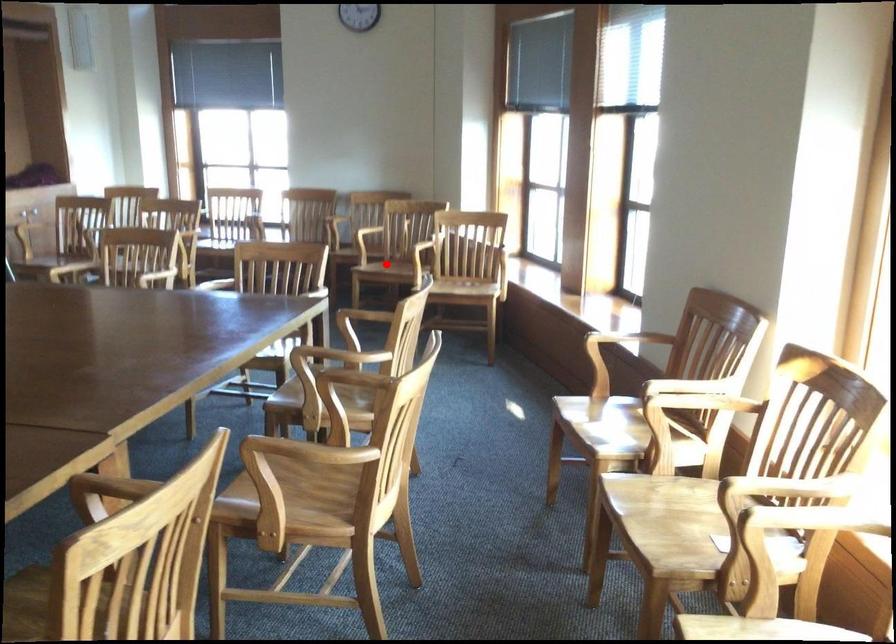
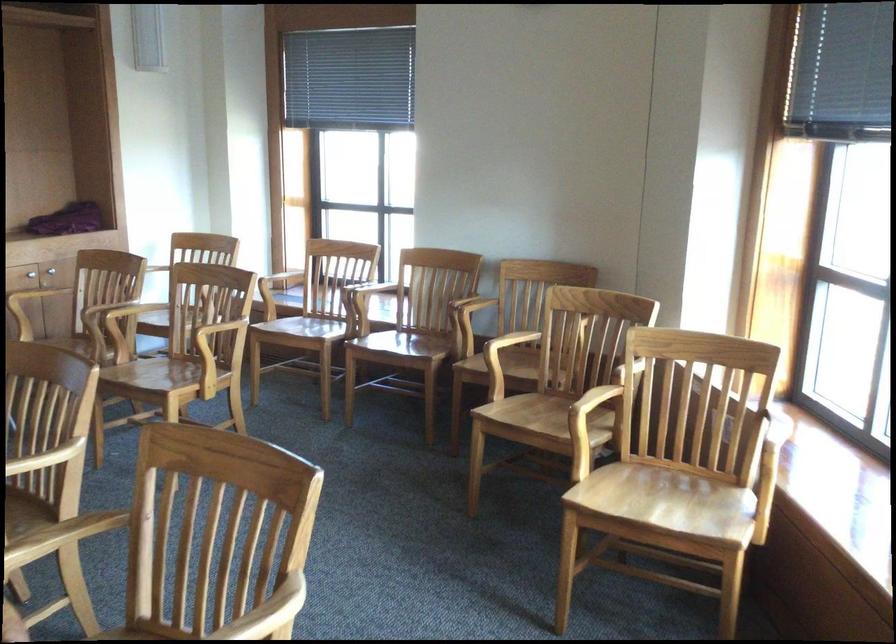
Question: I am providing you with two images of the same scene from different viewpoints. A red point is shown in image1. For the corresponding object point in image2, is it positioned nearer or farther from the camera?

Choices:
 (A) Nearer
 (B) Farther

Answer: (A)